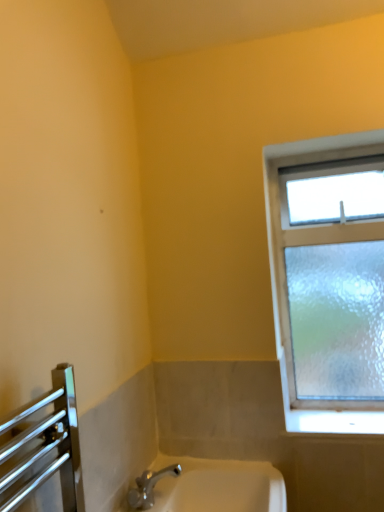
Question: Can you confirm if white ceramic sink at lower center is thinner than frosted glass window at upper right?

Choices:
 (A) no
 (B) yes

Answer: (A)

Question: Does white ceramic sink at lower center have a smaller size compared to frosted glass window at upper right?

Choices:
 (A) yes
 (B) no

Answer: (A)

Question: From the image's perspective, is white ceramic sink at lower center below frosted glass window at upper right?

Choices:
 (A) yes
 (B) no

Answer: (A)

Question: Is white ceramic sink at lower center in contact with frosted glass window at upper right?

Choices:
 (A) yes
 (B) no

Answer: (B)

Question: Can you confirm if white ceramic sink at lower center is shorter than frosted glass window at upper right?

Choices:
 (A) yes
 (B) no

Answer: (A)

Question: Does white ceramic sink at lower center have a greater height compared to frosted glass window at upper right?

Choices:
 (A) yes
 (B) no

Answer: (B)

Question: Are frosted glass window at upper right and white ceramic sink at lower center making contact?

Choices:
 (A) yes
 (B) no

Answer: (B)

Question: Considering the relative sizes of frosted glass window at upper right and white ceramic sink at lower center in the image provided, is frosted glass window at upper right smaller than white ceramic sink at lower center?

Choices:
 (A) no
 (B) yes

Answer: (A)

Question: Is frosted glass window at upper right to the left of white ceramic sink at lower center from the viewer's perspective?

Choices:
 (A) no
 (B) yes

Answer: (A)

Question: Is the depth of frosted glass window at upper right greater than that of white ceramic sink at lower center?

Choices:
 (A) yes
 (B) no

Answer: (A)

Question: From the image's perspective, is frosted glass window at upper right beneath white ceramic sink at lower center?

Choices:
 (A) yes
 (B) no

Answer: (B)

Question: From the image's perspective, is frosted glass window at upper right located above white ceramic sink at lower center?

Choices:
 (A) yes
 (B) no

Answer: (A)

Question: Looking at their shapes, would you say frosted glass window at upper right is wider or thinner than white ceramic sink at lower center?

Choices:
 (A) thin
 (B) wide

Answer: (A)